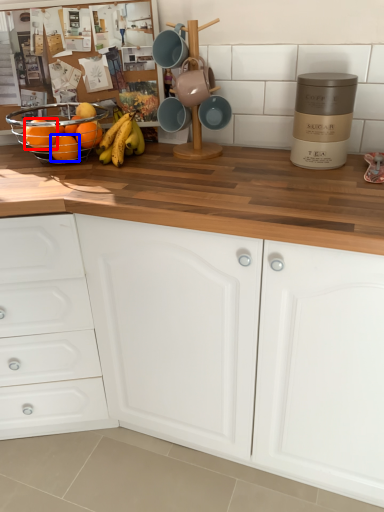
Question: Which object appears closest to the camera in this image, orange (highlighted by a red box) or orange (highlighted by a blue box)?

Choices:
 (A) orange
 (B) orange

Answer: (A)